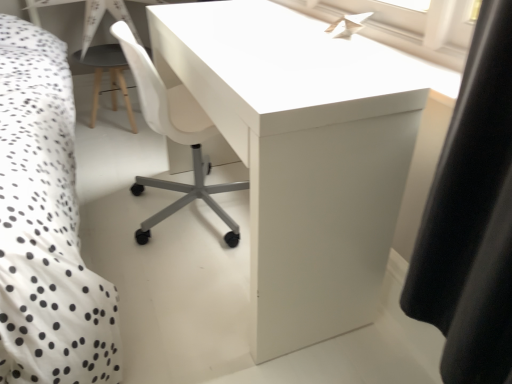
Question: Considering the positions of point (454, 77) and point (117, 62), is point (454, 77) closer or farther from the camera than point (117, 62)?

Choices:
 (A) farther
 (B) closer

Answer: (B)

Question: From a real-world perspective, is white paper airplane at upper center physically located above or below matte gray stool at left?

Choices:
 (A) above
 (B) below

Answer: (A)

Question: Considering the real-world distances, which object is closest to the white glossy desk at center?

Choices:
 (A) matte gray stool at left
 (B) white paper airplane at upper center

Answer: (B)

Question: Which object is the closest to the white paper airplane at upper center?

Choices:
 (A) matte gray stool at left
 (B) white glossy desk at center

Answer: (B)